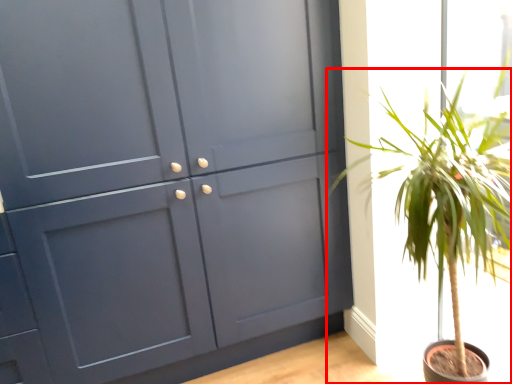
Question: Where is houseplant (annotated by the red box) located in relation to cupboard in the image?

Choices:
 (A) left
 (B) right

Answer: (B)